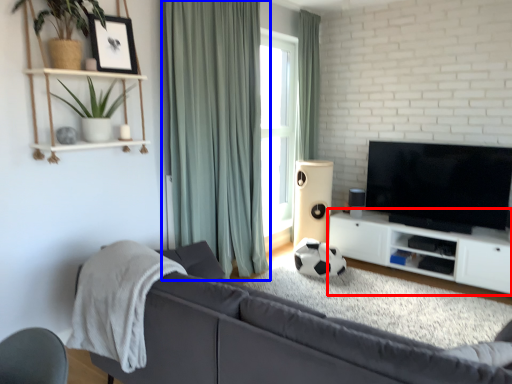
Question: Which of the following is the farthest to the observer, cabinetry (highlighted by a red box) or curtain (highlighted by a blue box)?

Choices:
 (A) cabinetry
 (B) curtain

Answer: (A)